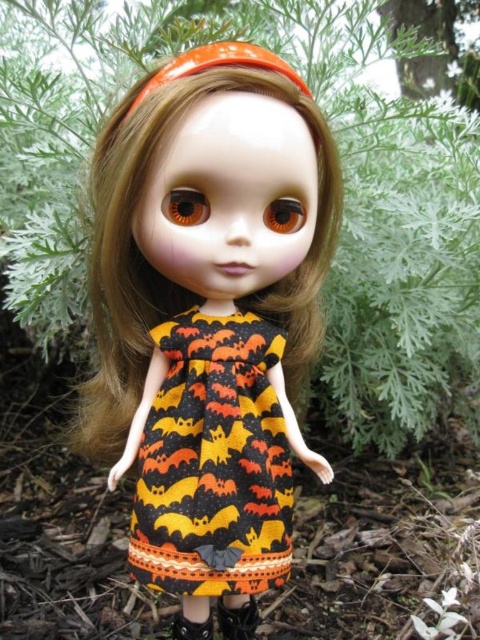
Question: Does orange fabric dress at center have a smaller size compared to black matte shoe at lower center?

Choices:
 (A) no
 (B) yes

Answer: (A)

Question: Which object is closer to the camera taking this photo?

Choices:
 (A) black matte shoe at lower center
 (B) black leather shoe at lower center

Answer: (B)

Question: Is black matte shoe at lower center behind black leather shoe at lower center?

Choices:
 (A) yes
 (B) no

Answer: (A)

Question: Which object is farther from the camera taking this photo?

Choices:
 (A) orange fabric dress at center
 (B) orange bat print fabric dress at center
 (C) green leafy plant at center

Answer: (C)

Question: Is orange fabric dress at center to the right of green leafy plant at center from the viewer's perspective?

Choices:
 (A) no
 (B) yes

Answer: (A)

Question: Which point is farther to the camera?

Choices:
 (A) green leafy plant at center
 (B) black leather shoe at lower center
 (C) orange bat print fabric dress at center
 (D) black matte shoe at lower center

Answer: (A)